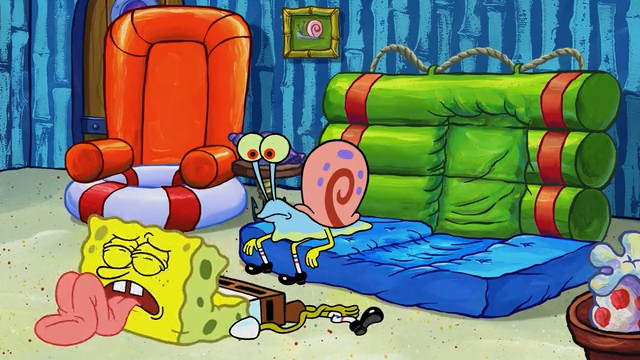
The height and width of the screenshot is (360, 640). I want to click on chair, so click(124, 108).